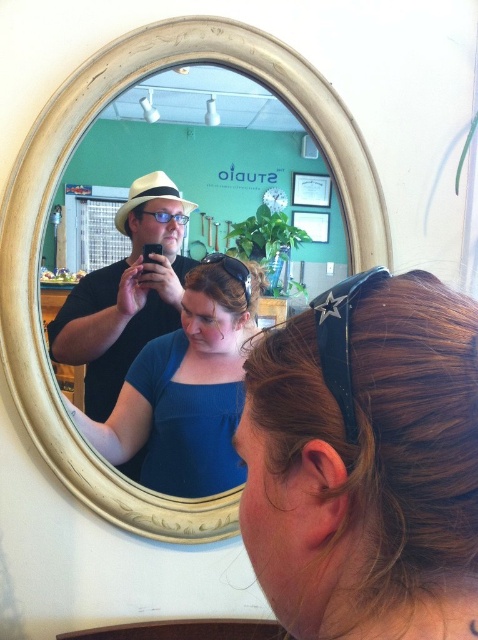
Is white wooden mirror at upper center bigger than brown matte hair at center?

Correct, white wooden mirror at upper center is larger in size than brown matte hair at center.

Can you confirm if white wooden mirror at upper center is taller than brown matte hair at center?

→ Indeed, white wooden mirror at upper center has a greater height compared to brown matte hair at center.

Is point (97, 156) behind point (215, 296)?

No, (97, 156) is closer to viewer.

What are the coordinates of `white wooden mirror at upper center` in the screenshot? It's located at (158, 353).

How far apart are brown hair at center and white wooden mirror at upper center?

brown hair at center is 3.58 feet from white wooden mirror at upper center.

Is point (343, 477) behind point (55, 326)?

No, (343, 477) is closer to viewer.

Locate an element on the screen. The height and width of the screenshot is (640, 478). brown hair at center is located at coordinates (366, 461).

Is brown hair at center in front of brown matte hair at center?

Yes, it is in front of brown matte hair at center.

Does brown hair at center have a greater height compared to brown matte hair at center?

Indeed, brown hair at center has a greater height compared to brown matte hair at center.

The height and width of the screenshot is (640, 478). Find the location of `brown hair at center`. brown hair at center is located at coordinates (366, 461).